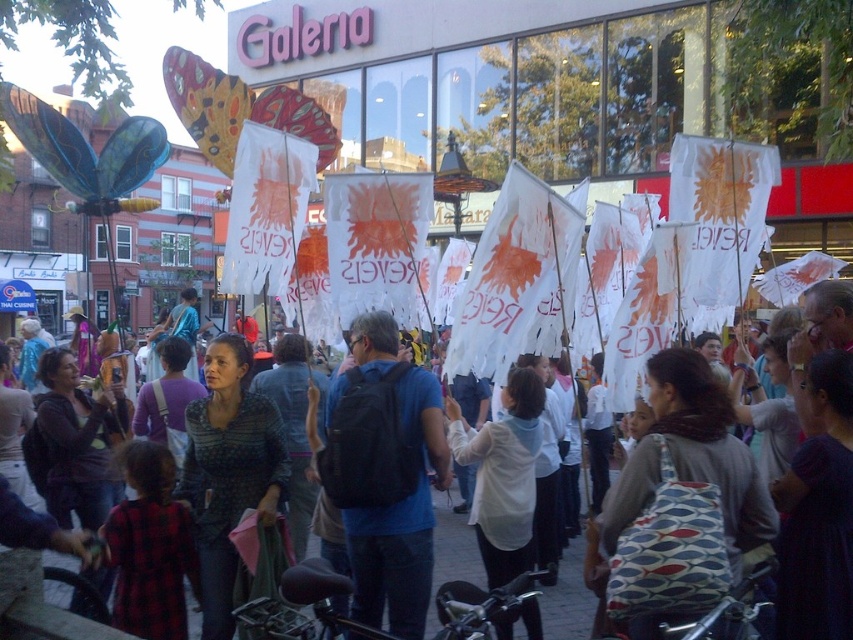
Question: Is white matte shirt at center closer to camera compared to white paper flags at center?

Choices:
 (A) no
 (B) yes

Answer: (B)

Question: Observing the image, what is the correct spatial positioning of white matte shirt at center in reference to white paper flags at center?

Choices:
 (A) right
 (B) left

Answer: (B)

Question: From the image, what is the correct spatial relationship of white matte shirt at center in relation to white paper flags at center?

Choices:
 (A) left
 (B) right

Answer: (A)

Question: Among these points, which one is nearest to the camera?

Choices:
 (A) (480, 512)
 (B) (68, 589)

Answer: (A)